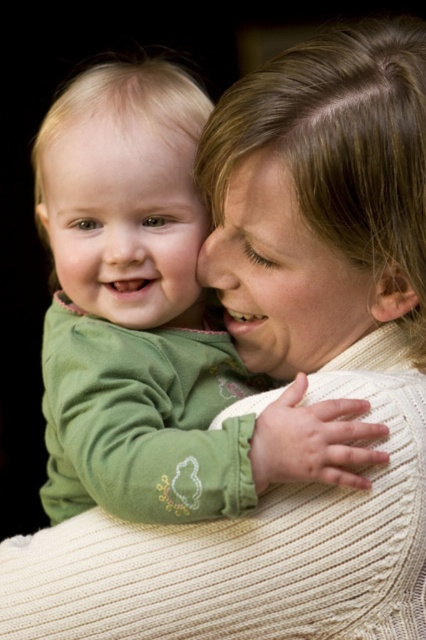
Question: Which object appears farthest from the camera in this image?

Choices:
 (A) green soft fabric baby at center
 (B) smooth green baby at center
 (C) smooth skin face at center

Answer: (B)

Question: Does green soft fabric baby at center appear over smooth green baby at center?

Choices:
 (A) yes
 (B) no

Answer: (B)

Question: Can you confirm if green soft fabric baby at center is positioned to the left of smooth green baby at center?

Choices:
 (A) yes
 (B) no

Answer: (B)

Question: Among these points, which one is nearest to the camera?

Choices:
 (A) (187, 227)
 (B) (345, 326)

Answer: (A)

Question: Which is nearer to the smooth green baby at center?

Choices:
 (A) green soft fabric baby at center
 (B) smooth skin face at center

Answer: (A)

Question: Is smooth green baby at center to the left of smooth skin face at center from the viewer's perspective?

Choices:
 (A) no
 (B) yes

Answer: (B)